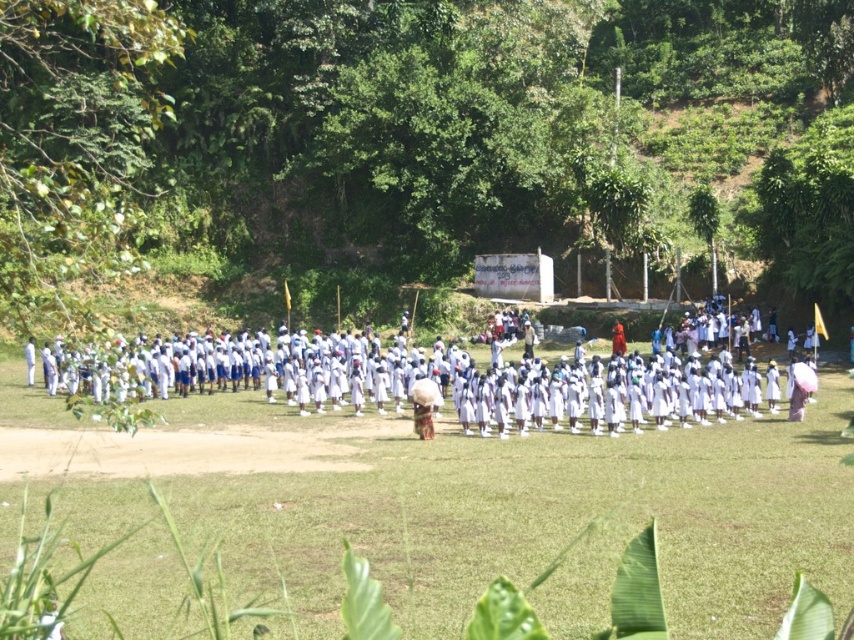
You are a photographer standing at the edge of the grassy field. You want to take a photo that includes both the white fabric at center and the white cotton uniform at center. Which object should you focus on first to ensure both are in clear view?

You should focus on the white fabric at center first since it is closer to you than the white cotton uniform at center, ensuring both are in clear view.

You are a photographer at the event and need to capture a clear shot of the white cotton uniform at center without the white fabric at center obstructing it. How should you adjust your camera angle?

The white fabric at center is below the white cotton uniform at center, so you can angle the camera slightly upward to avoid the white fabric at center blocking the view of the white cotton uniform at center.

You are organizing a school event and need to decide whether to use the white fabric at center as a backdrop or the white cotton uniform at center as a prop. Based on their sizes, which one is wider?

The white fabric at center is wider than the white cotton uniform at center, so it would be more suitable as a backdrop due to its larger width.